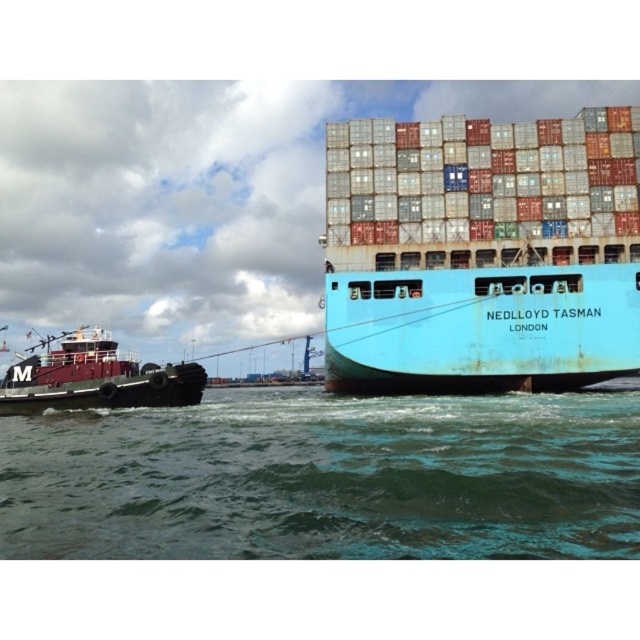
Question: From the image, what is the correct spatial relationship of green water at lower center in relation to maroon rubber tugboat at left?

Choices:
 (A) above
 (B) below

Answer: (B)

Question: Does green water at lower center have a larger size compared to blue matte container ship at center?

Choices:
 (A) no
 (B) yes

Answer: (A)

Question: Which point is closer to the camera?

Choices:
 (A) (83, 376)
 (B) (502, 352)
 (C) (356, 406)

Answer: (B)

Question: Which of the following is the farthest from the observer?

Choices:
 (A) green water at lower center
 (B) maroon rubber tugboat at left

Answer: (B)

Question: In this image, where is green water at lower center located relative to maroon rubber tugboat at left?

Choices:
 (A) left
 (B) right

Answer: (B)

Question: Which point appears closest to the camera in this image?

Choices:
 (A) (611, 218)
 (B) (362, 460)

Answer: (B)